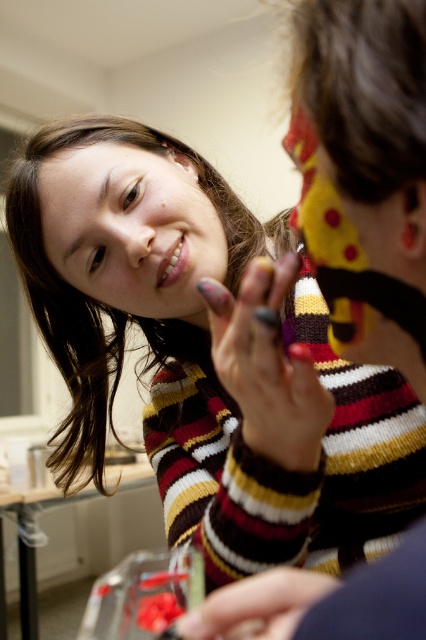
Question: Based on their relative distances, which object is nearer to the matte striped sweater at center?

Choices:
 (A) matte white lipstick at lower center
 (B) matte skin face at upper left

Answer: (B)

Question: Considering the real-world distances, which object is closest to the matte white lipstick at lower center?

Choices:
 (A) matte skin face at upper left
 (B) matte striped sweater at center

Answer: (A)

Question: Does matte striped sweater at center appear under matte white lipstick at lower center?

Choices:
 (A) yes
 (B) no

Answer: (A)

Question: Can you confirm if matte skin face at upper left is positioned above matte white lipstick at lower center?

Choices:
 (A) yes
 (B) no

Answer: (A)

Question: Does matte striped sweater at center appear under matte skin face at upper left?

Choices:
 (A) yes
 (B) no

Answer: (A)

Question: Which object is positioned farthest from the matte striped sweater at center?

Choices:
 (A) matte skin face at upper left
 (B) matte white lipstick at lower center

Answer: (B)